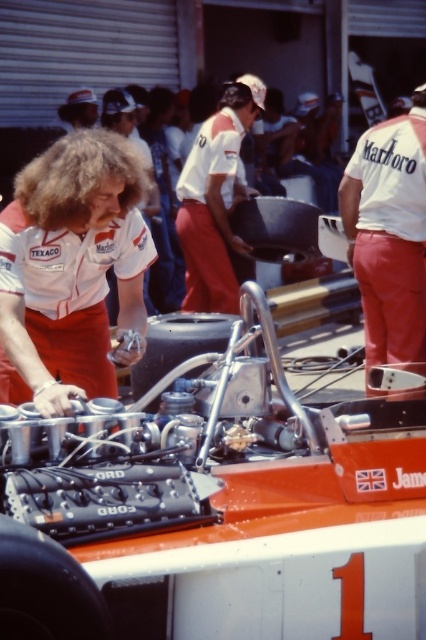
Where is the white fabric marlboro shirt at center located in the image?

The white fabric marlboro shirt at center is located at point [389,234] in the image.